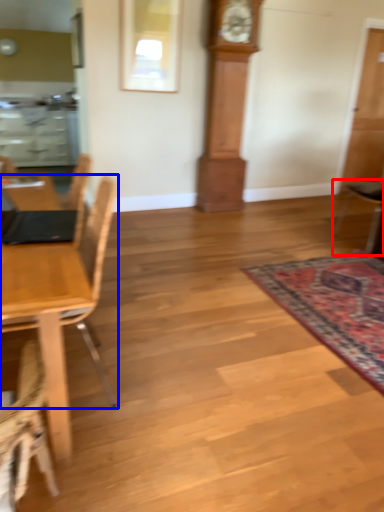
Question: Among these objects, which one is farthest to the camera, chair (highlighted by a red box) or chair (highlighted by a blue box)?

Choices:
 (A) chair
 (B) chair

Answer: (A)